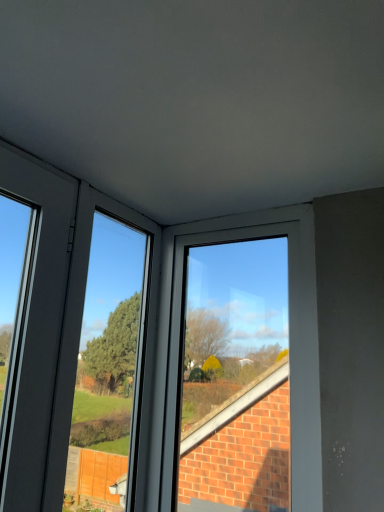
Question: Are white plastic window at center and matte gray window frame at center beside each other?

Choices:
 (A) yes
 (B) no

Answer: (B)

Question: Is there a large distance between white plastic window at center and matte gray window frame at center?

Choices:
 (A) yes
 (B) no

Answer: (B)

Question: Does white plastic window at center come behind matte gray window frame at center?

Choices:
 (A) no
 (B) yes

Answer: (B)

Question: From a real-world perspective, is white plastic window at center physically above matte gray window frame at center?

Choices:
 (A) yes
 (B) no

Answer: (A)

Question: Does white plastic window at center come in front of matte gray window frame at center?

Choices:
 (A) yes
 (B) no

Answer: (B)

Question: Is white plastic window at center at the left side of matte gray window frame at center?

Choices:
 (A) yes
 (B) no

Answer: (B)

Question: Is matte gray window frame at center thinner than white plastic window at center?

Choices:
 (A) no
 (B) yes

Answer: (B)

Question: Is matte gray window frame at center to the left of white plastic window at center from the viewer's perspective?

Choices:
 (A) no
 (B) yes

Answer: (B)

Question: From the image's perspective, does matte gray window frame at center appear higher than white plastic window at center?

Choices:
 (A) no
 (B) yes

Answer: (B)

Question: Can you confirm if matte gray window frame at center is bigger than white plastic window at center?

Choices:
 (A) yes
 (B) no

Answer: (B)

Question: Would you consider matte gray window frame at center to be distant from white plastic window at center?

Choices:
 (A) no
 (B) yes

Answer: (A)

Question: From a real-world perspective, is matte gray window frame at center located higher than white plastic window at center?

Choices:
 (A) no
 (B) yes

Answer: (A)

Question: From a real-world perspective, is white plastic window at center above or below matte gray window frame at center?

Choices:
 (A) above
 (B) below

Answer: (A)